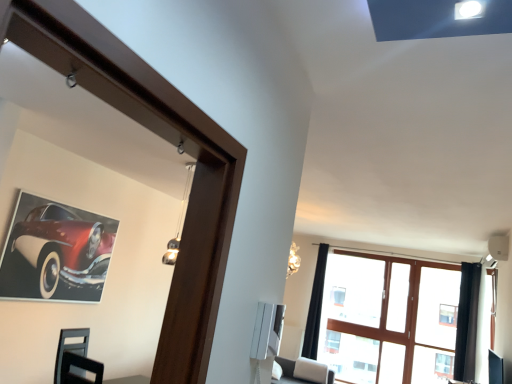
Locate an element on the screen. blank space above shiny red car at upper left (from a real-world perspective) is located at coordinates (59, 196).